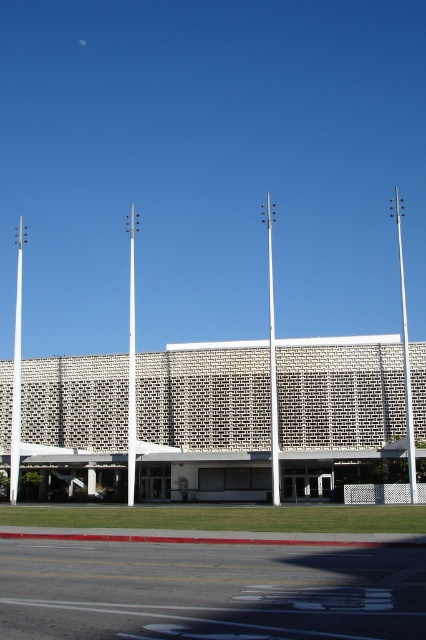
Find the location of a particular element. white smooth pole at left is located at coordinates (17, 371).

Who is positioned more to the left, white smooth pole at left or silver metallic pole at right?

Positioned to the left is white smooth pole at left.

Identify the location of white smooth pole at left. The height and width of the screenshot is (640, 426). (17, 371).

Where is `white smooth pole at left`? The width and height of the screenshot is (426, 640). white smooth pole at left is located at coordinates (17, 371).

Can you confirm if white smooth pole at left is positioned below white metallic pole at center?

Yes.

Identify the location of white smooth pole at left. (17, 371).

Based on the photo, is the position of white metallic pole at center less distant than that of white smooth pole at center?

Yes, it is in front of white smooth pole at center.

Does white metallic pole at center have a lesser height compared to white smooth pole at center?

Incorrect, white metallic pole at center's height does not fall short of white smooth pole at center's.

Does point (276, 416) come behind point (135, 458)?

Yes, point (276, 416) is behind point (135, 458).

You are a GUI agent. You are given a task and a screenshot of the screen. Output one action in this format:
    pyautogui.click(x=<x>, y=<y>)
    Task: Click on the white metallic pole at center
    The image size is (426, 640).
    Given the screenshot: What is the action you would take?
    pyautogui.click(x=271, y=358)